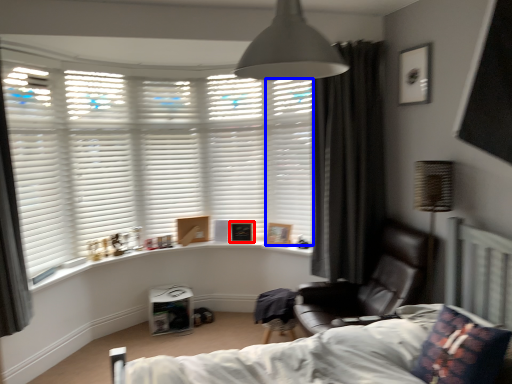
Question: Which point is closer to the camera, picture frame (highlighted by a red box) or shutter (highlighted by a blue box)?

Choices:
 (A) picture frame
 (B) shutter

Answer: (B)